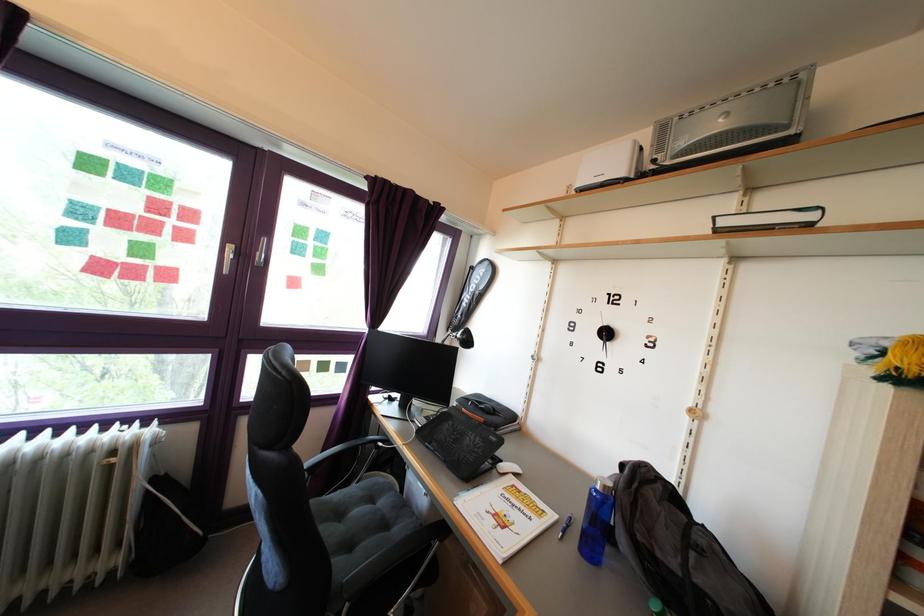
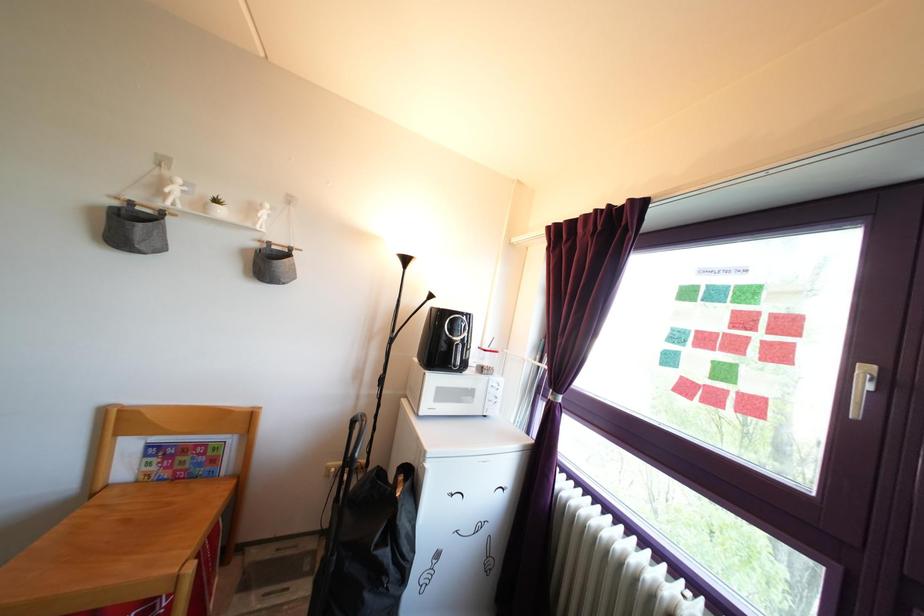
In the second image, find the point that corresponds to the point at 137,282 in the first image.

(715, 407)